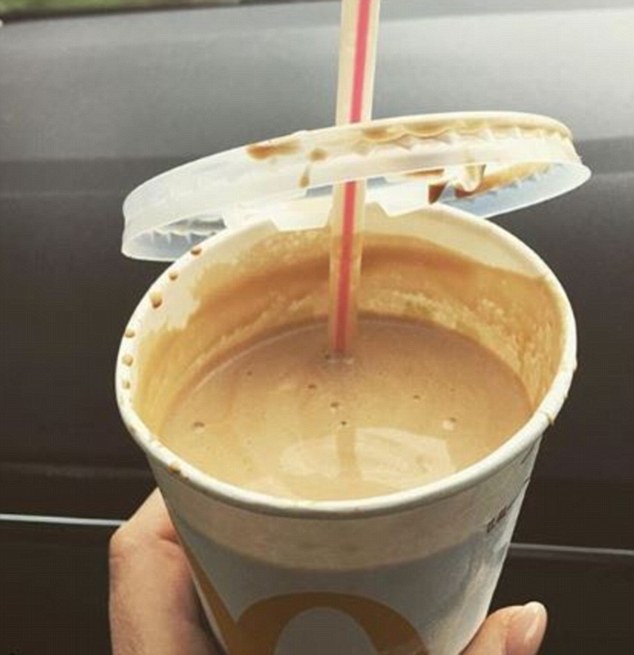
I want to click on inside left side of cup, so click(145, 398).